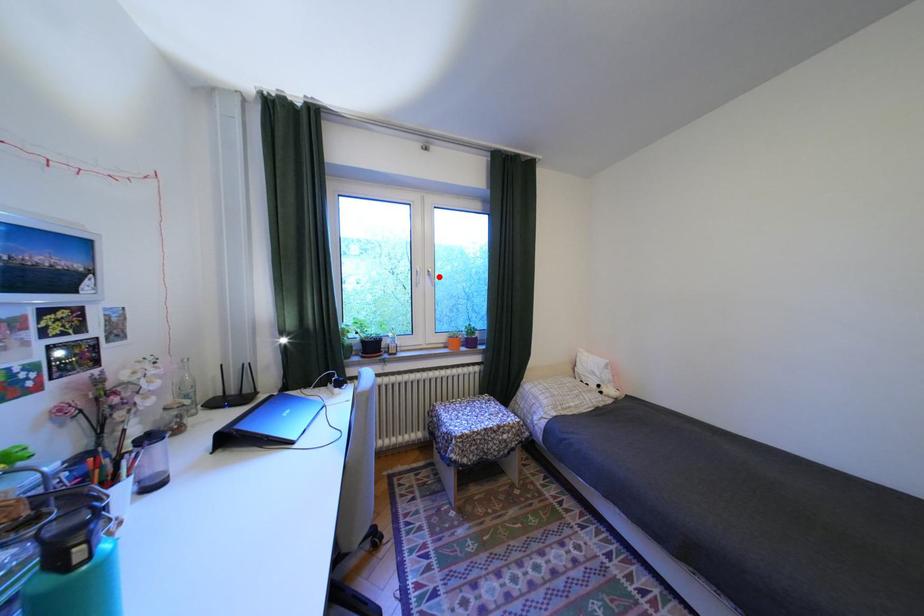
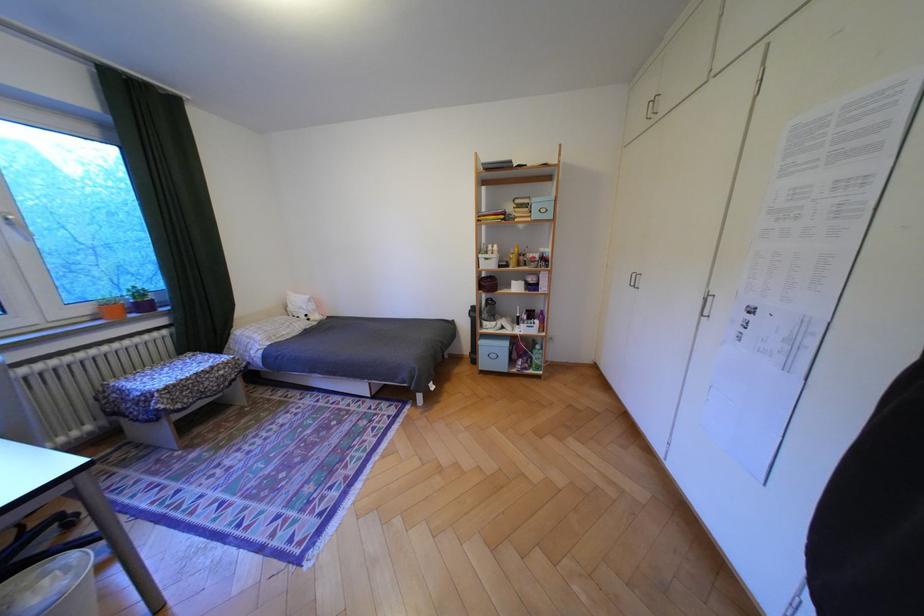
Question: A red point is marked in image1. In image2, is the corresponding 3D point closer to the camera or farther? Reply with the corresponding letter.

Choices:
 (A) The corresponding 3D point is closer.
 (B) The corresponding 3D point is farther.

Answer: (B)